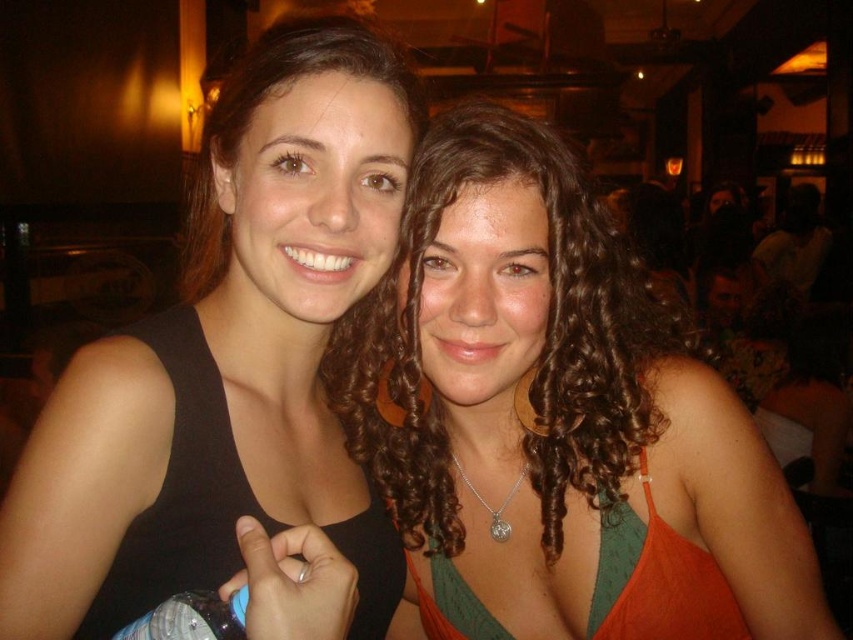
You are a photographer trying to focus on the black matte tank top at left and the curly hair at center. Which object is nearer to you?

The black matte tank top at left is closer to the viewer than the curly hair at center.

You are a photographer trying to capture a clear shot of both the black matte tank top at left and the curly hair at center. Since the camera has a depth of field of 6 inches, will both objects be in focus?

The black matte tank top at left is 6.38 inches away from curly hair at center. Since the distance between them exceeds the camera depth of field of 6 inches, the two objects will not both be in focus.

You are a photographer trying to capture a clear shot of both the black matte tank top at left and the curly hair at center. Based on their sizes, which object should you focus on first to ensure it is in sharp focus?

The black matte tank top at left is narrower than the curly hair at center, so you should focus on the curly hair at center first to ensure it is in sharp focus.